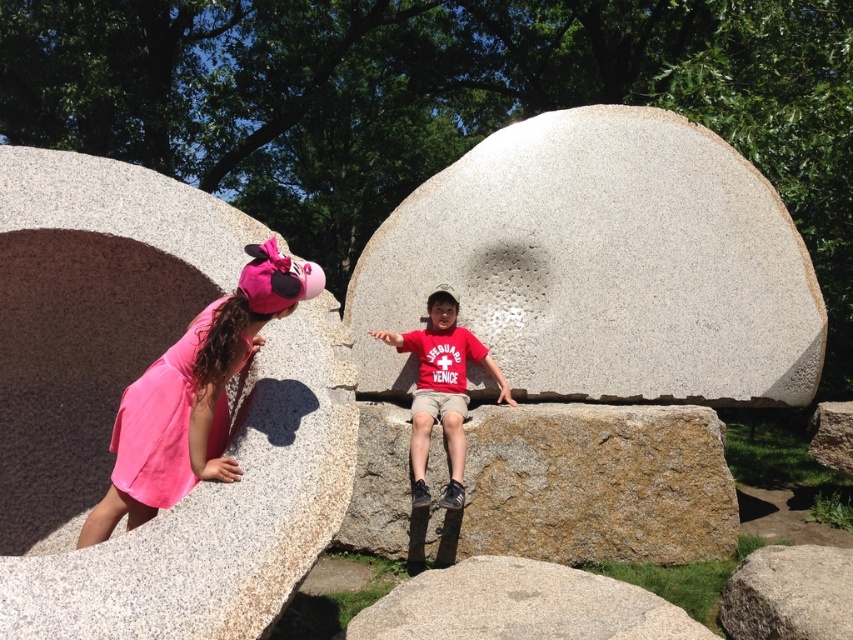
Question: Can you confirm if gray granite stone at center is positioned below pink fabric dress at left?

Choices:
 (A) no
 (B) yes

Answer: (A)

Question: Based on their relative distances, which object is farther from the granite boulder at left?

Choices:
 (A) pink fabric dress at left
 (B) brown rough stone at center

Answer: (B)

Question: Can you confirm if pink fabric dress at left is positioned to the right of gray granite rock at lower center?

Choices:
 (A) yes
 (B) no

Answer: (B)

Question: Which of these objects is positioned farthest from the gray granite rock at center?

Choices:
 (A) granite boulder at left
 (B) gray granite stone at center

Answer: (A)

Question: Does brown rough stone at center have a lesser width compared to pink fabric dress at left?

Choices:
 (A) no
 (B) yes

Answer: (A)

Question: Which of the following is the farthest from the observer?

Choices:
 (A) gray granite rock at center
 (B) gray granite rock at lower center
 (C) brown rough stone at center

Answer: (C)